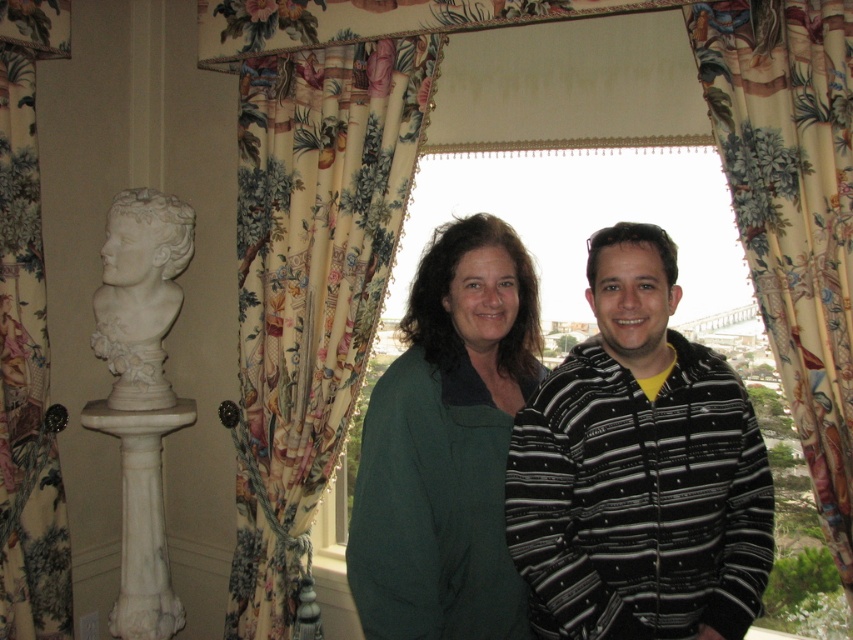
You are a tailor measuring fabrics for a project. You have a piece of fabric that is exactly the same width as the floral fabric curtain at left. Can the green woolen sweater at center be made from this fabric without needing to sew multiple pieces together?

The green woolen sweater at center is wider than the floral fabric curtain at left. Since the fabric you have matches the curtain width, it might not be wide enough for the sweater unless you can sew multiple pieces together.

You are a photographer trying to capture a clear shot of the green woolen sweater at center and the floral fabric curtain at left. Since you want both items in focus, which one should you adjust your camera focus on first?

The green woolen sweater at center is closer to the viewer than the floral fabric curtain at left, so you should focus on the green woolen sweater at center first to ensure both are in focus.

You are standing in the room and want to move from the point at coordinates point [370,609] to the point at coordinates point [376,516]. Which direction should you move in relation to the window?

Point [370,609] is in front of point [376,516], so to move from point [370,609] to point [376,516], you should move away from the window.